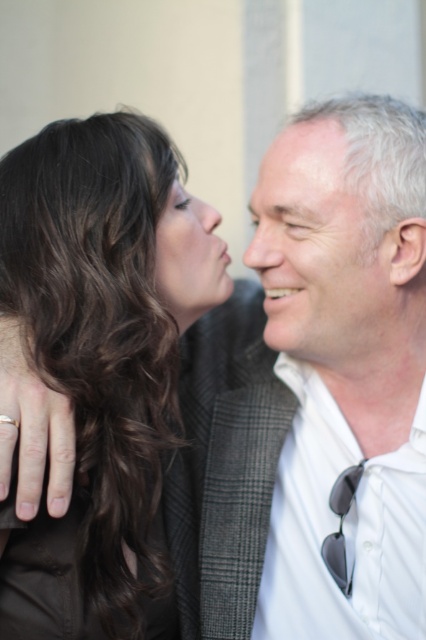
Which is behind, point (270, 236) or point (347, 188)?

Point (270, 236)

What do you see at coordinates (322, 256) in the screenshot? I see `white matte face at center` at bounding box center [322, 256].

Is point (299, 200) positioned before point (265, 204)?

Yes, it is.

The image size is (426, 640). Identify the location of white matte face at center. (322, 256).

Between gray checkered suit at center and dark brown hair at left, which one has less height?

gray checkered suit at center is shorter.

Find the location of a particular element. This screenshot has width=426, height=640. gray checkered suit at center is located at coordinates (340, 376).

Who is more distant from viewer, (x=345, y=289) or (x=270, y=172)?

The point (x=270, y=172) is behind.

Measure the distance between gray checkered suit at center and gray matte forehead at upper center.

8.50 inches

Image resolution: width=426 pixels, height=640 pixels. I want to click on gray checkered suit at center, so click(x=340, y=376).